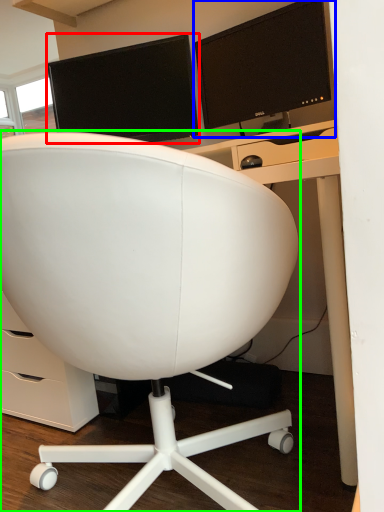
Question: Which object is the farthest from computer monitor (highlighted by a red box)? Choose among these: computer monitor (highlighted by a blue box) or chair (highlighted by a green box).

Choices:
 (A) computer monitor
 (B) chair

Answer: (B)